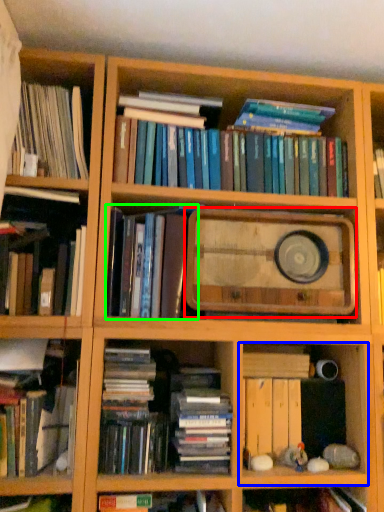
Question: Considering the real-world distances, which object is closest to paperback book (highlighted by a red box)? cabinet (highlighted by a blue box) or book (highlighted by a green box).

Choices:
 (A) cabinet
 (B) book

Answer: (B)